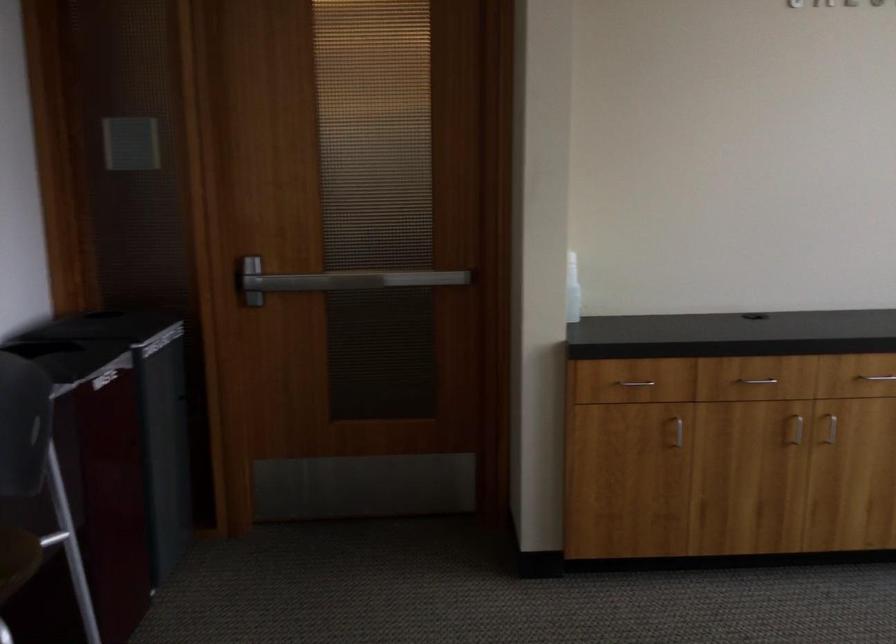
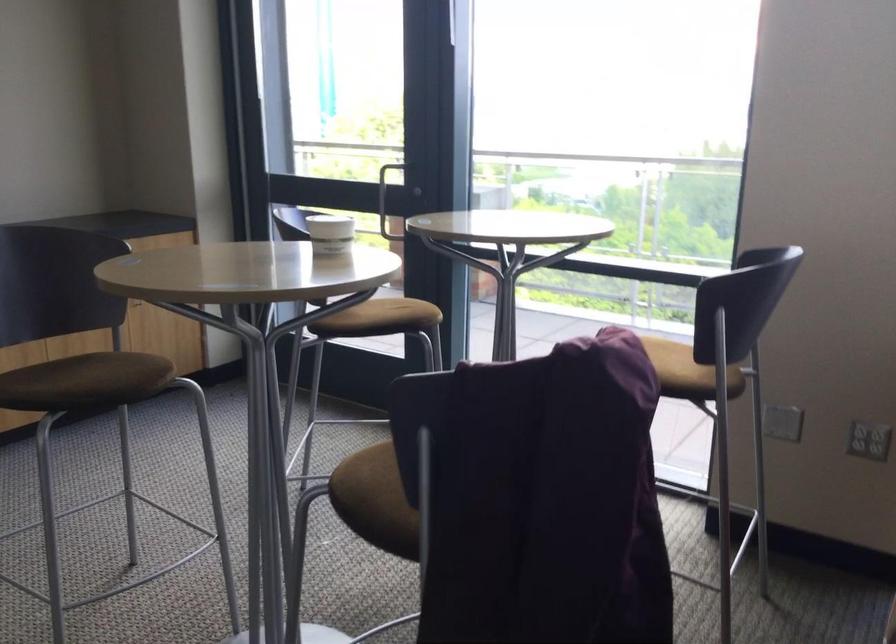
Question: The camera is either moving clockwise (left) or counter-clockwise (right) around the object. The first image is from the beginning of the video and the second image is from the end. Is the camera moving left or right when shooting the video?

Choices:
 (A) Left
 (B) Right

Answer: (A)